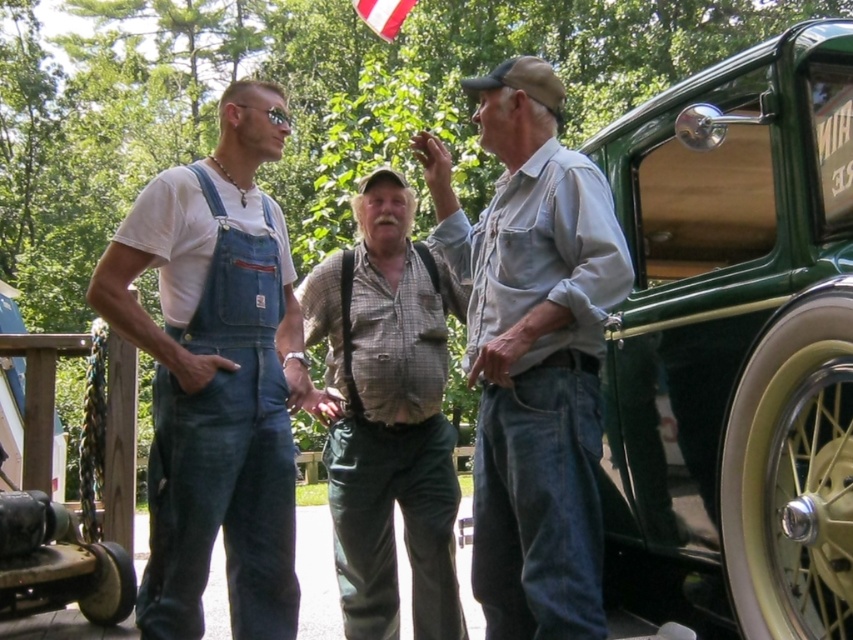
Question: Which of the following is the closest to the observer?

Choices:
 (A) (525, 108)
 (B) (759, 426)
 (C) (397, 465)

Answer: (B)

Question: Can you confirm if green polished wood door at right is positioned below white fabric flag at upper center?

Choices:
 (A) yes
 (B) no

Answer: (A)

Question: Among these points, which one is farthest from the camera?

Choices:
 (A) (426, 458)
 (B) (524, 125)
 (C) (299, 317)

Answer: (A)

Question: Observing the image, what is the correct spatial positioning of green polished wood door at right in reference to white fabric flag at upper center?

Choices:
 (A) below
 (B) above

Answer: (A)

Question: Is green polished wood door at right wider than denim overalls at left?

Choices:
 (A) no
 (B) yes

Answer: (B)

Question: Among these points, which one is nearest to the camera?

Choices:
 (A) (357, 500)
 (B) (373, 8)
 (C) (503, 104)
 (D) (711, 317)

Answer: (C)